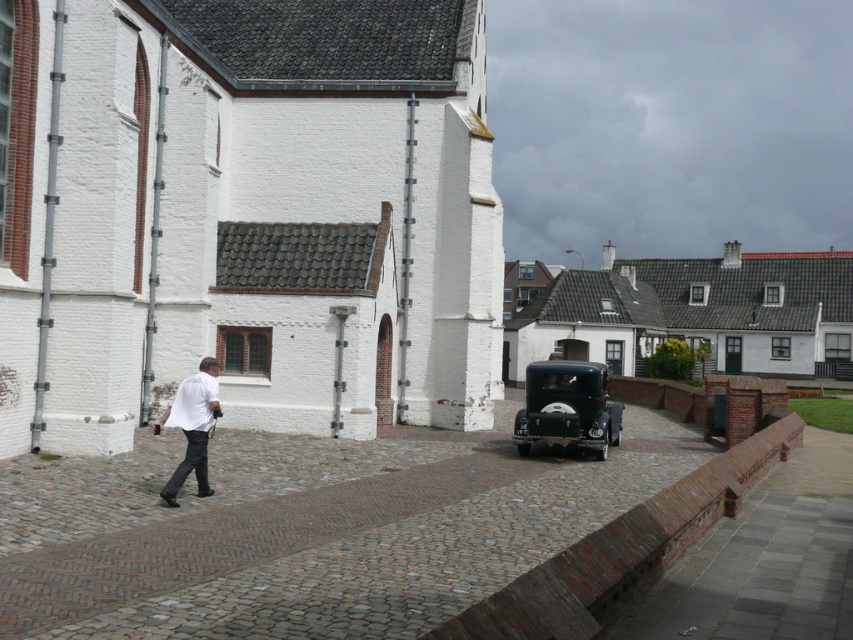
You are standing at the point labeled as point (306,529) in the image. What type of surface are you currently standing on?

You are standing on the brown cobblestone pavement at center.

You are a delivery driver who needs to park the shiny black car at center on the brown cobblestone pavement at center. Based on the scene, can you determine if the pavement is wide enough to accommodate the car?

The brown cobblestone pavement at center might be wider than shiny black car at center, so there is a possibility that the pavement can accommodate the car, but further measurement is needed to confirm.